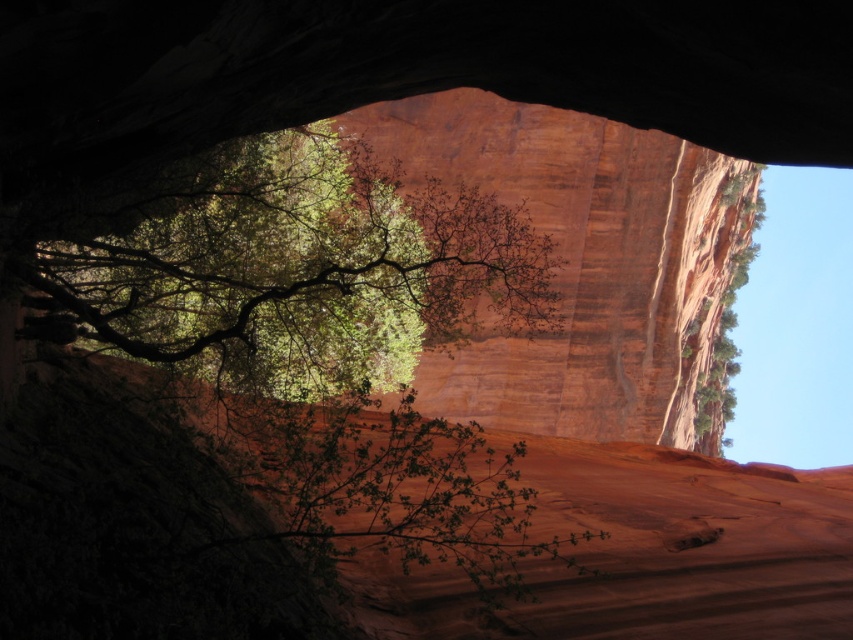
Does green leafy tree at center come in front of green leafy tree at upper right?

Yes, green leafy tree at center is closer to the viewer.

Does green leafy tree at center appear over green leafy tree at upper right?

Yes, green leafy tree at center is above green leafy tree at upper right.

Who is more distant from viewer, (222,225) or (720,364)?

The point (720,364) is behind.

Image resolution: width=853 pixels, height=640 pixels. In order to click on green leafy tree at center in this screenshot , I will do `click(285, 268)`.